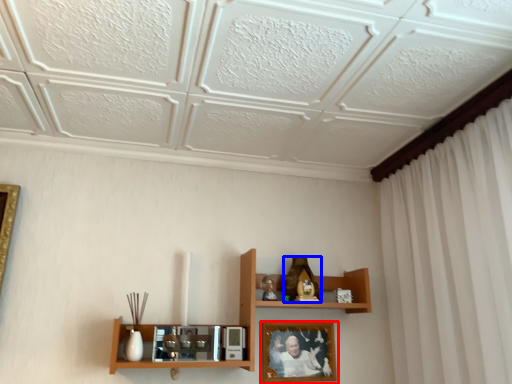
Question: Which object appears farthest to the camera in this image, picture frame (highlighted by a red box) or toy (highlighted by a blue box)?

Choices:
 (A) picture frame
 (B) toy

Answer: (B)